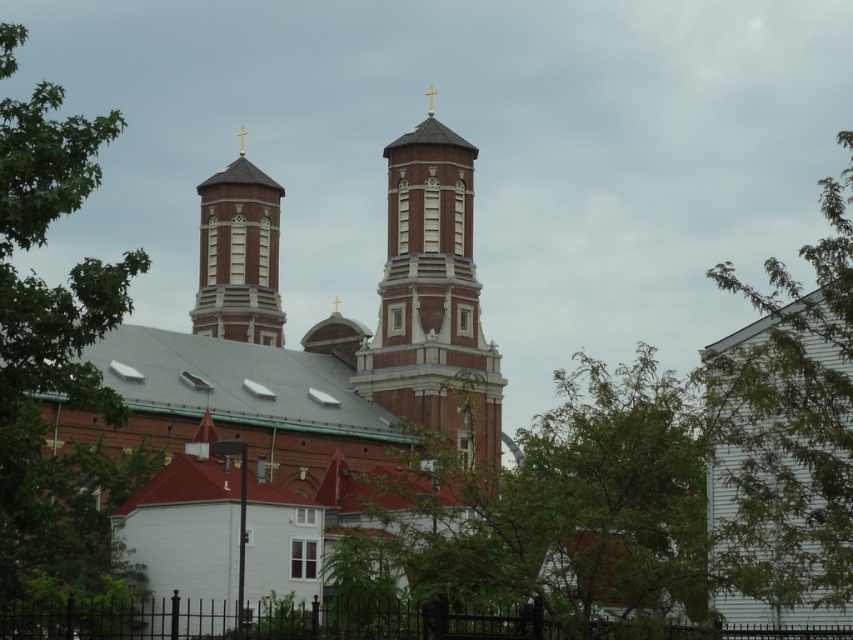
Question: Can you confirm if brick steeple at center is wider than matte brick tower at upper left?

Choices:
 (A) yes
 (B) no

Answer: (A)

Question: Based on their relative distances, which object is farther from the brick church at center?

Choices:
 (A) brick steeple at center
 (B) matte brick tower at upper left
 (C) green leafy tree at right
 (D) green leafy tree at left

Answer: (C)

Question: Can you confirm if brick church at center is positioned below brick steeple at center?

Choices:
 (A) yes
 (B) no

Answer: (B)

Question: Which point is farther to the camera?

Choices:
 (A) green leafy tree at left
 (B) green leafy tree at right
 (C) brick church at center
 (D) matte brick tower at upper left

Answer: (D)

Question: Does green leafy tree at right have a larger size compared to green leafy tree at left?

Choices:
 (A) no
 (B) yes

Answer: (B)

Question: Which object is closer to the camera taking this photo?

Choices:
 (A) brick church at center
 (B) green leafy tree at right

Answer: (B)